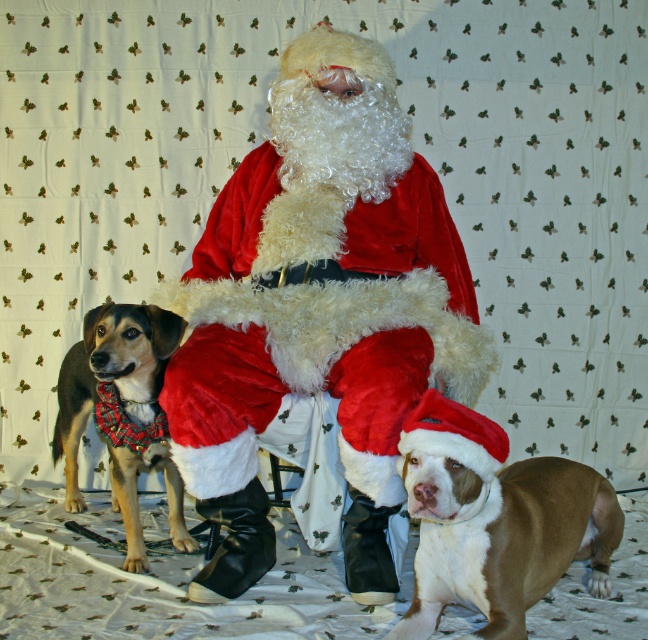
You are organizing a Christmas photo session and need to ensure that the velvet santa at center and the brown and white fur at lower right are visible in the frame. Given that the camera has a fixed focus that prioritizes larger objects, which subject should you adjust the focus to capture clearly?

The velvet santa at center is bigger than the brown and white fur at lower right, so the camera will automatically focus on the velvet santa at center due to its larger size.

In the festive scene, you see the velvet santa at center and the plaid fabric dog at left. Which object is positioned to the right of the other?

The velvet santa at center is to the right of the plaid fabric dog at left.

You are a photographer setting up for a Christmas photo shoot. You need to position a spotlight so that it illuminates the velvet santa at center without casting a shadow on the brown and white fur at lower right. Given their positions, where should you place the spotlight relative to Santa?

The brown and white fur at lower right is behind velvet santa at center, so placing the spotlight in front of Santa would ensure the light hits Santa directly while the dog behind remains in shadow. Alternatively, positioning the spotlight above Santa could cast light downward, avoiding the area behind.